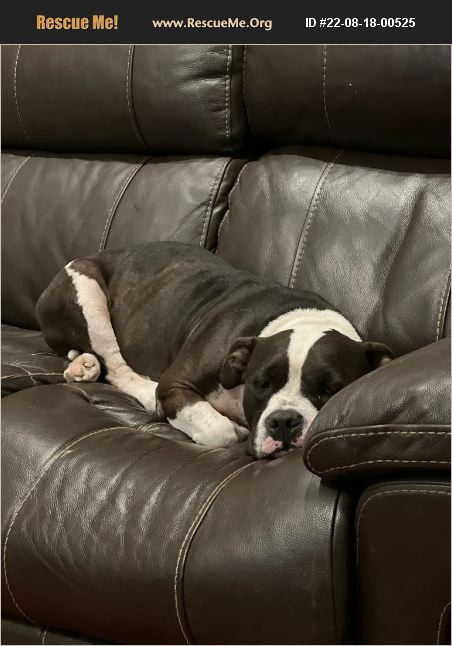
Find the location of `headrest on couch`. headrest on couch is located at coordinates (183, 103), (270, 81).